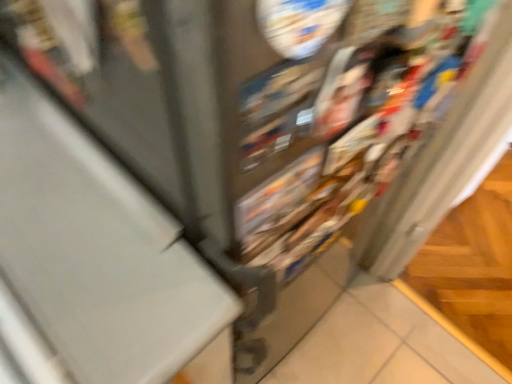
Question: Should I look upward or downward to see wooden at right?

Choices:
 (A) down
 (B) up

Answer: (A)